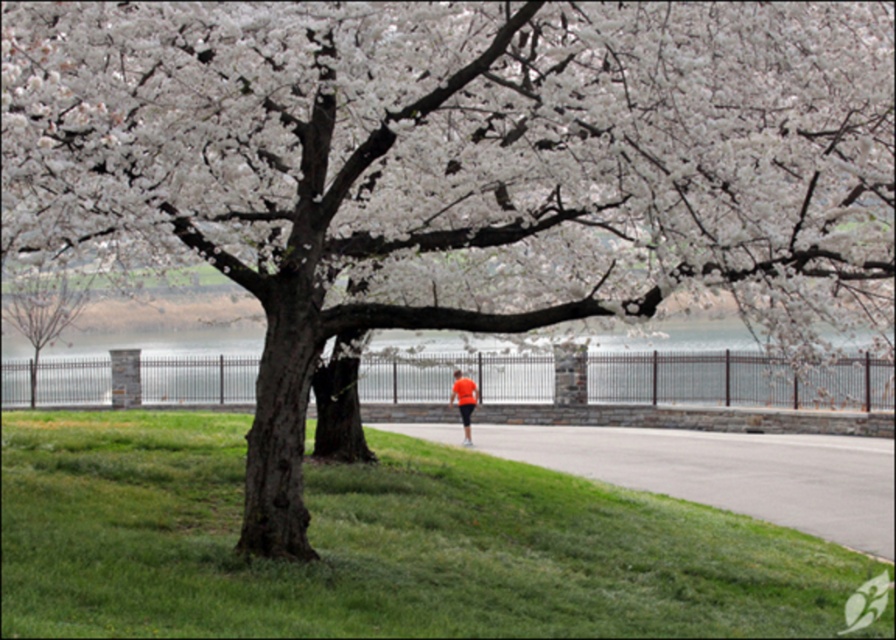
Question: From the image, what is the correct spatial relationship of gray asphalt pavement at lower center in relation to orange fabric shorts at center?

Choices:
 (A) below
 (B) above

Answer: (A)

Question: Which object appears closest to the camera in this image?

Choices:
 (A) gray asphalt pavement at lower center
 (B) orange fabric shorts at center

Answer: (A)

Question: Does gray asphalt pavement at lower center come behind orange fabric shorts at center?

Choices:
 (A) no
 (B) yes

Answer: (A)

Question: Which of these objects is positioned farthest from the smooth bark tree at left?

Choices:
 (A) orange fabric shorts at center
 (B) gray asphalt pavement at lower center

Answer: (B)

Question: Is smooth bark tree at left below orange fabric shorts at center?

Choices:
 (A) no
 (B) yes

Answer: (A)

Question: Which of the following is the farthest from the observer?

Choices:
 (A) orange fabric shorts at center
 (B) smooth bark tree at left
 (C) gray asphalt pavement at lower center

Answer: (A)